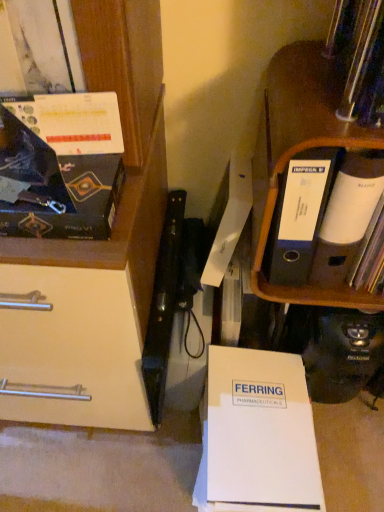
Identify the location of vacant area on top of white paper at lower center (from a real-world perspective). This screenshot has width=384, height=512. (246, 397).